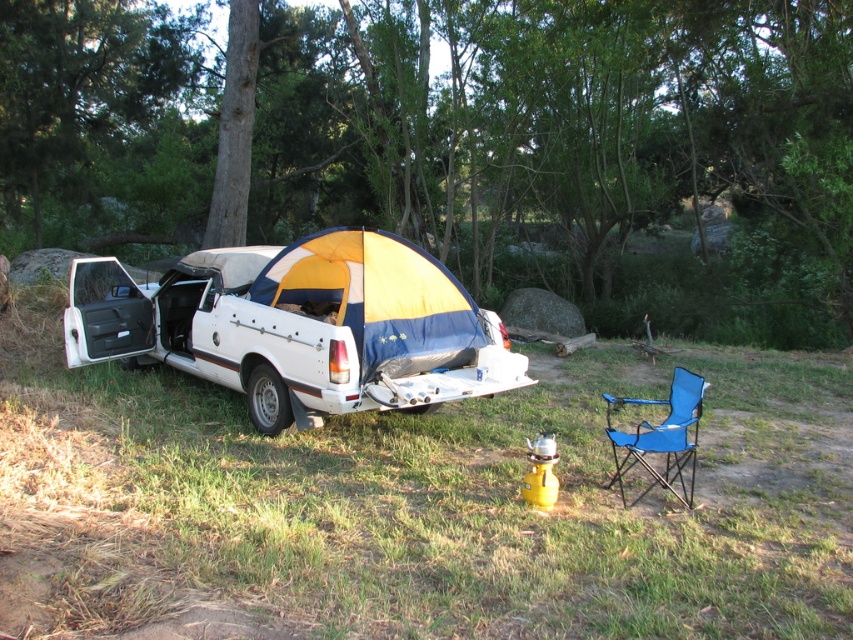
You are planning to take a photo of the white matte car at center and the green leafy tree at upper center. Which object should you focus on first if you want to capture both in a single frame without moving the camera?

You should focus on the white matte car at center first because it is closer to the camera than the green leafy tree at upper center, allowing both to be in the frame without needing to adjust the camera position.

You are a hiker trying to take a photo of the white matte car at center from the position of the green leafy tree at upper center. Will the tree block your view of the car?

The white matte car at center is behind the green leafy tree at upper center, so the tree will block your view of the car.